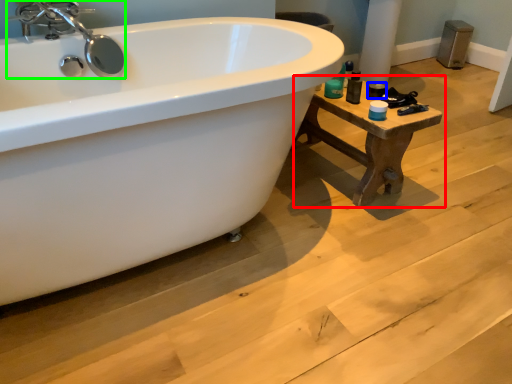
Question: Estimate the real-world distances between objects in this image. Which object is closer to table (highlighted by a red box), toiletry (highlighted by a blue box) or tap (highlighted by a green box)?

Choices:
 (A) toiletry
 (B) tap

Answer: (A)